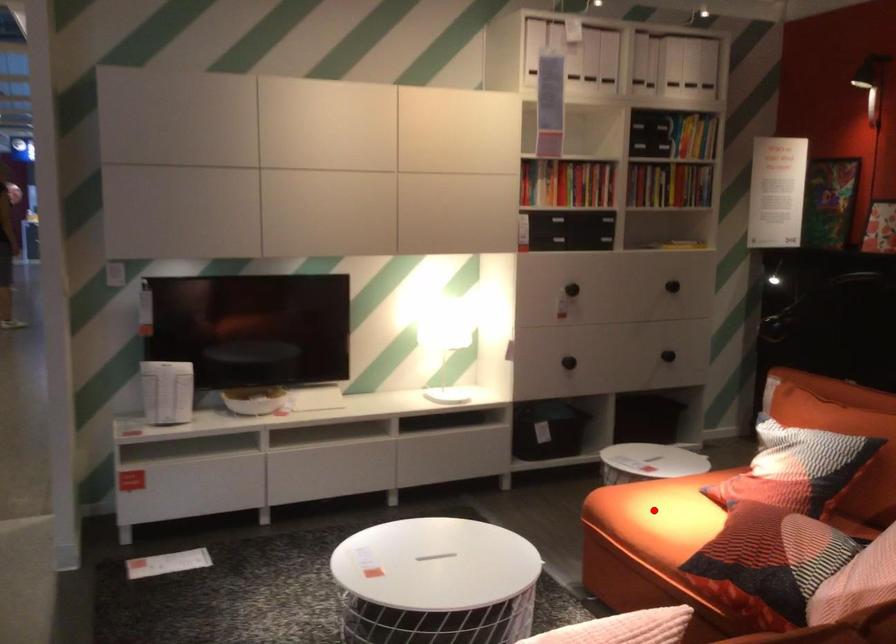
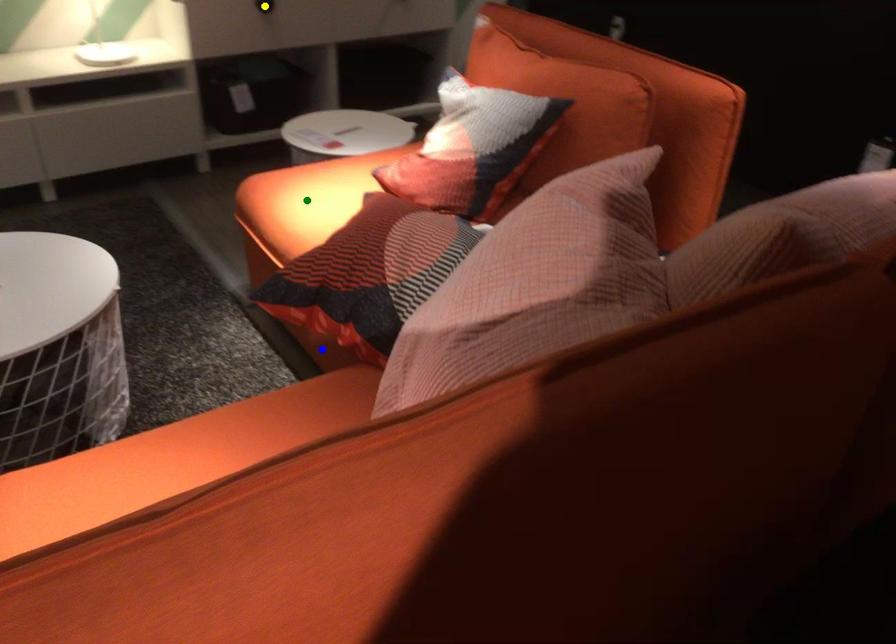
Question: I am providing you with two images of the same scene from different viewpoints. A red point is marked on the first image. You are given multiple points on the second image. In image 2, which mark is for the same physical point as the one in image 1?

Choices:
 (A) green point
 (B) blue point
 (C) yellow point

Answer: (A)